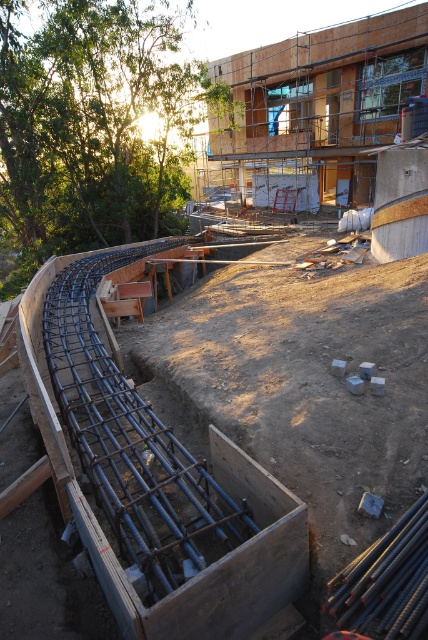
Question: Which point is closer to the camera?

Choices:
 (A) (264, 529)
 (B) (376, 77)

Answer: (A)

Question: Is black metal rebar at lower left wider than wooden scaffolding at upper center?

Choices:
 (A) yes
 (B) no

Answer: (B)

Question: Which point appears farthest from the camera in this image?

Choices:
 (A) (86, 596)
 (B) (386, 35)

Answer: (B)

Question: Can you confirm if black metal rebar at lower left is positioned to the right of wooden scaffolding at upper center?

Choices:
 (A) no
 (B) yes

Answer: (A)

Question: Is black metal rebar at lower left wider than wooden scaffolding at upper center?

Choices:
 (A) yes
 (B) no

Answer: (B)